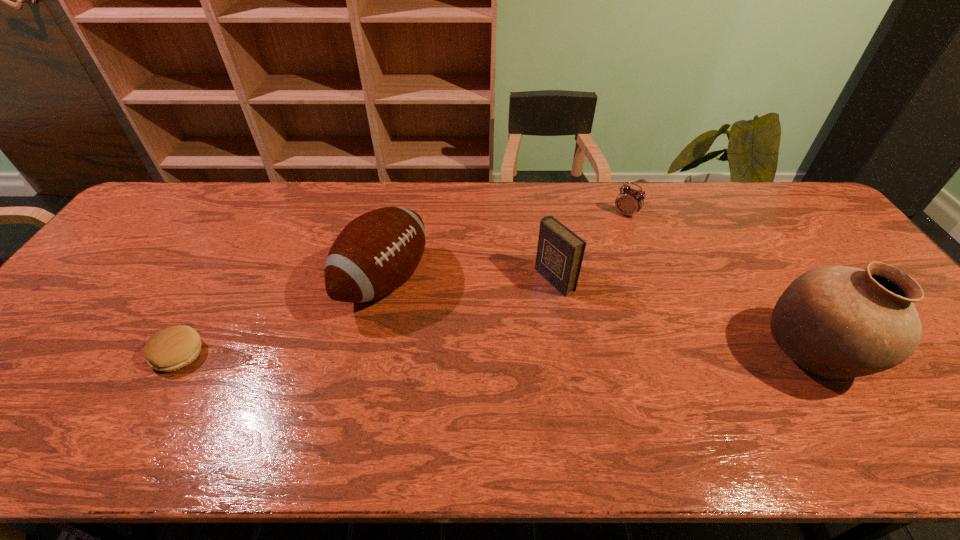
At what (x,y) coordinates should I click in order to perform the action: click on the fourth closest object to the second shortest object. Please return your answer as a coordinate pair (x, y). Image resolution: width=960 pixels, height=540 pixels. Looking at the image, I should click on (171, 348).

Locate which object is the closest to the second shortest object. Please provide its 2D coordinates. Your answer should be formatted as a tuple, i.e. [(x, y)], where the tuple contains the x and y coordinates of a point satisfying the conditions above.

[(560, 252)]

Where is `vacant space that satisfies the following two spatial constraints: 1. on the front side of the third object from left to right; 2. on the left side of the tallest object`? The width and height of the screenshot is (960, 540). vacant space that satisfies the following two spatial constraints: 1. on the front side of the third object from left to right; 2. on the left side of the tallest object is located at coordinates (566, 354).